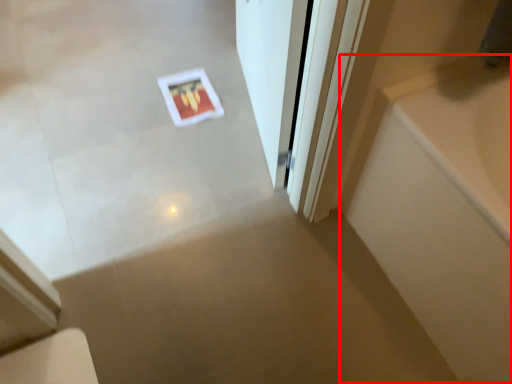
Question: From the image, what is the correct spatial relationship of bath (annotated by the red box) in relation to door?

Choices:
 (A) right
 (B) left

Answer: (A)